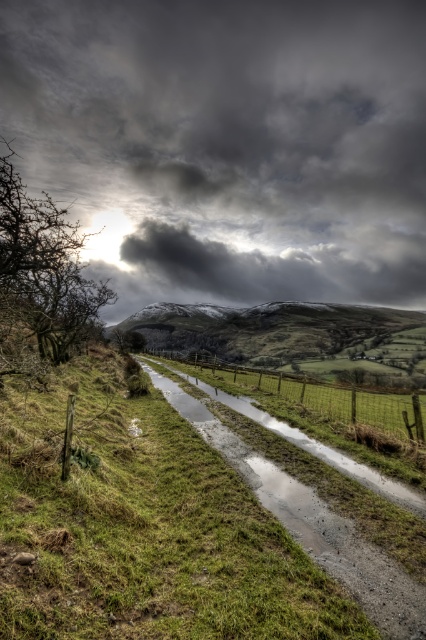
Question: Which object is the closest to the green grassy hillside at center?

Choices:
 (A) gray gravel stream at center
 (B) wooden fence at center
 (C) dark gray cloud at upper center

Answer: (B)

Question: Does dark gray cloud at upper center appear on the left side of gray gravel stream at center?

Choices:
 (A) no
 (B) yes

Answer: (B)

Question: Estimate the real-world distances between objects in this image. Which object is closer to the dark gray cloud at upper center?

Choices:
 (A) wooden fence at center
 (B) green grassy hillside at center
 (C) gray gravel stream at center

Answer: (B)

Question: Is dark gray cloud at upper center to the left of green grassy hillside at center from the viewer's perspective?

Choices:
 (A) no
 (B) yes

Answer: (B)

Question: Does dark gray cloud at upper center have a lesser width compared to wooden fence at center?

Choices:
 (A) no
 (B) yes

Answer: (A)

Question: Which point appears closest to the camera in this image?

Choices:
 (A) (420, 99)
 (B) (187, 394)
 (C) (380, 333)

Answer: (B)